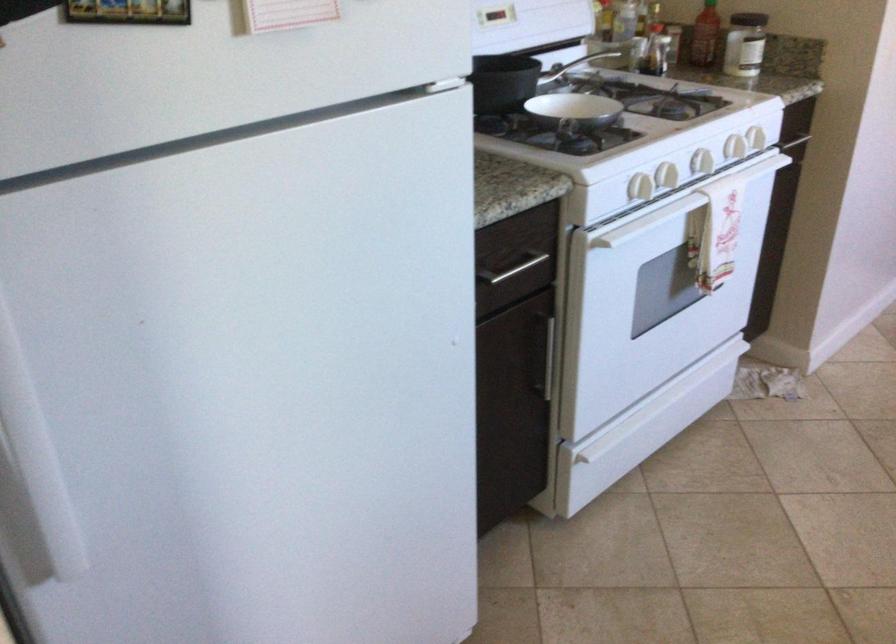
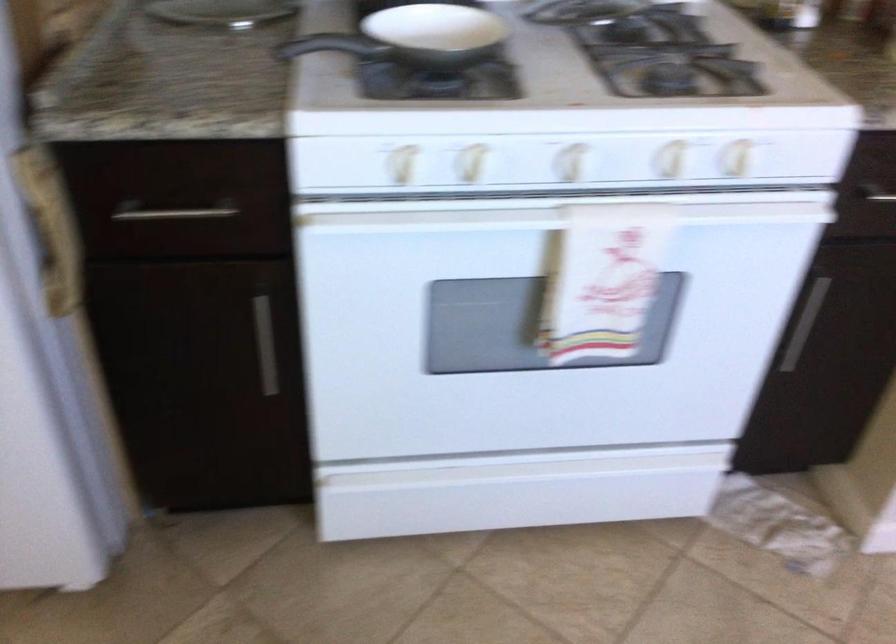
Where in the second image is the point corresponding to the point at 579,97 from the first image?

(315, 44)